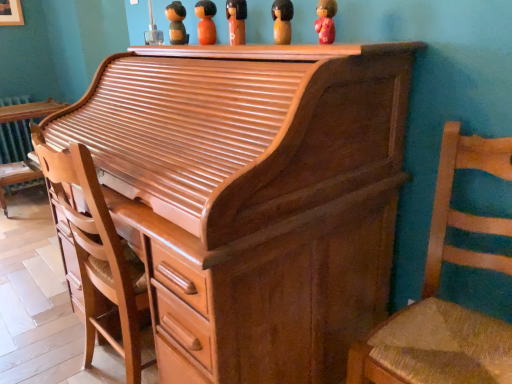
You are a GUI agent. You are given a task and a screenshot of the screen. Output one action in this format:
    pyautogui.click(x=<x>, y=<y>)
    Task: Click on the free space in front of wooden figurine at upper center, marked as the 2th toy in a right-to-left arrangement
    The height and width of the screenshot is (384, 512).
    Given the screenshot: What is the action you would take?
    (x=285, y=45)